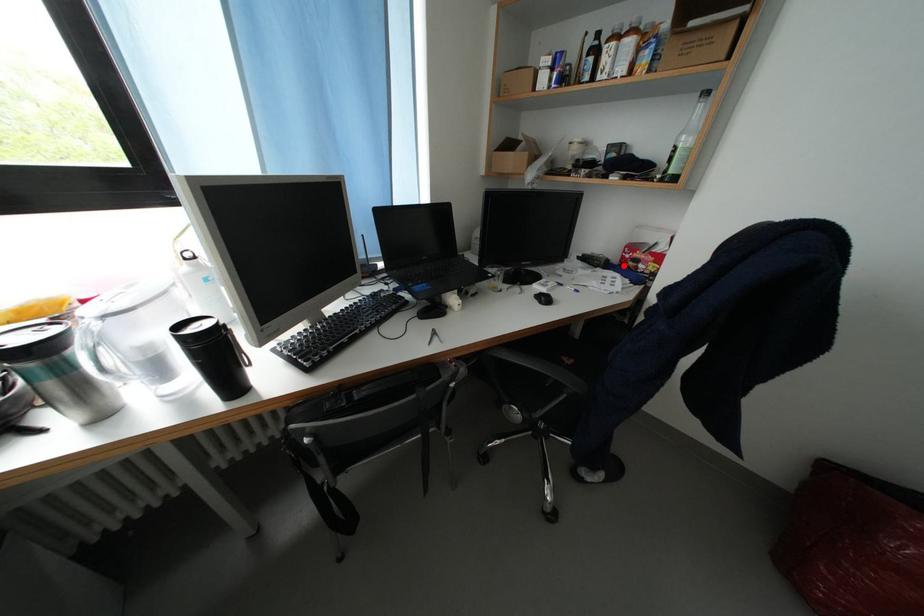
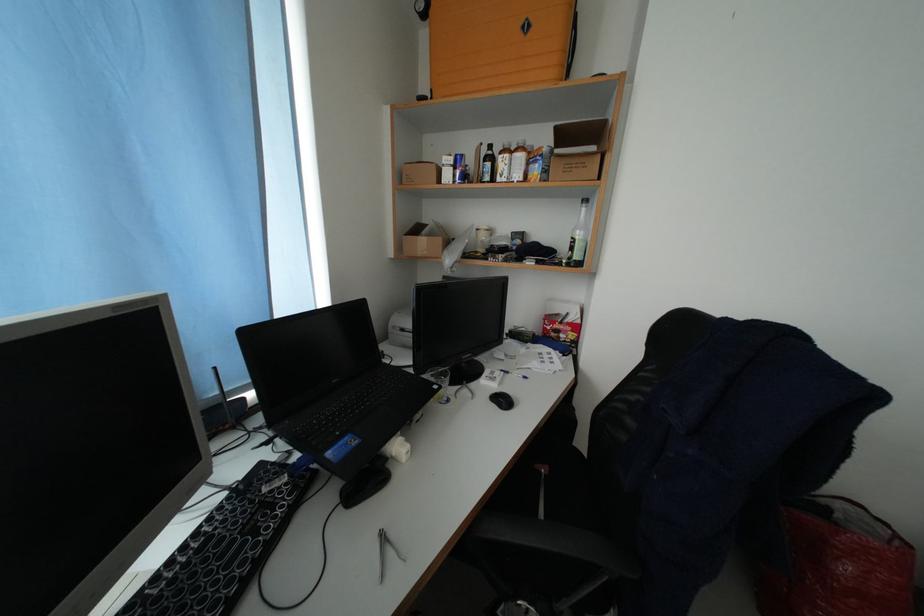
Question: I am providing you with two images of the same scene from different viewpoints. A red point is marked on the first image. At the location where the point appears in image 1, is it still visible in image 2?

Choices:
 (A) Yes
 (B) No

Answer: (A)